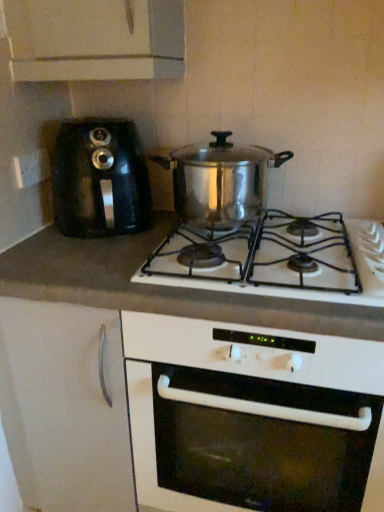
Where is `vacant area on top of white matte cabinet at lower left (from a real-world perspective)`? The image size is (384, 512). vacant area on top of white matte cabinet at lower left (from a real-world perspective) is located at coordinates (70, 252).